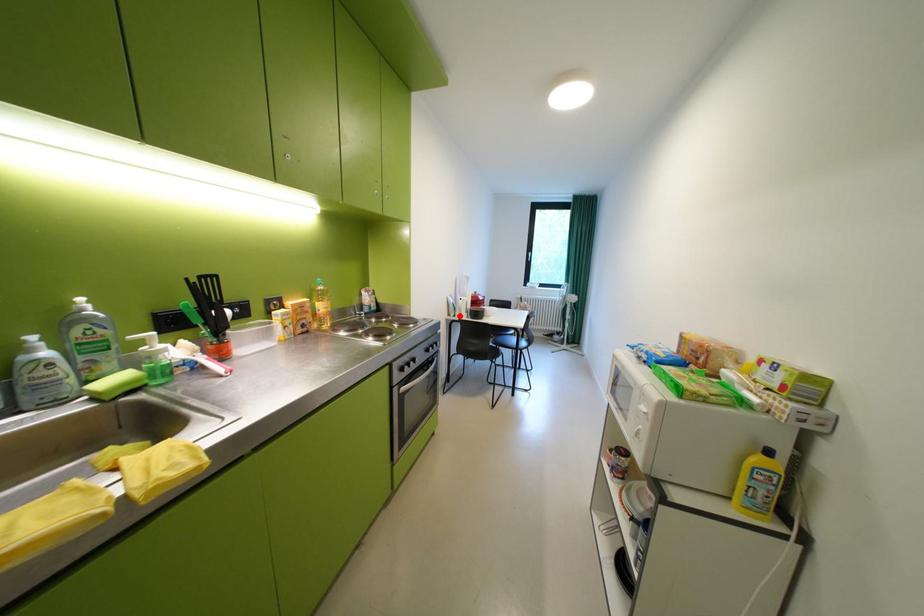
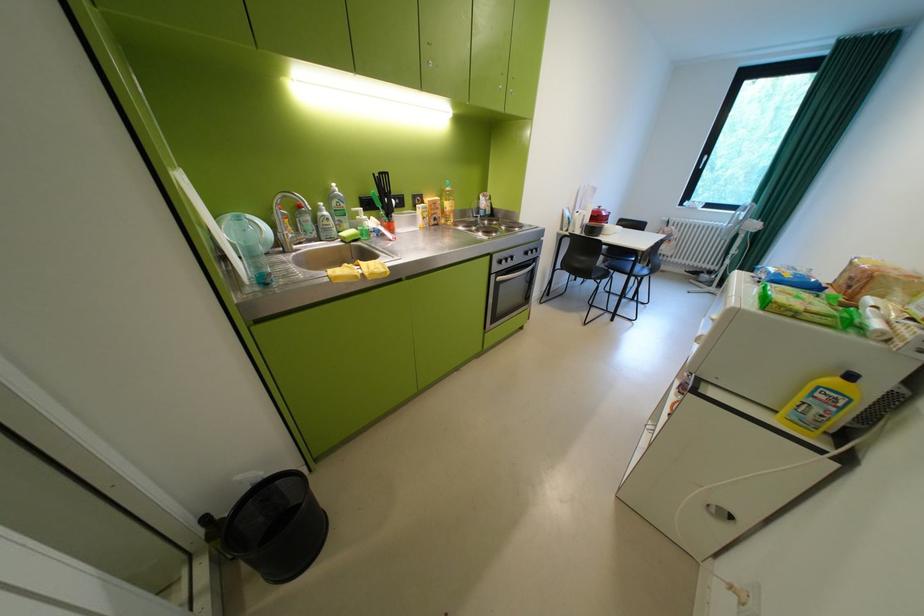
Where in the second image is the point corresponding to the highlighted location from the first image?

(572, 230)